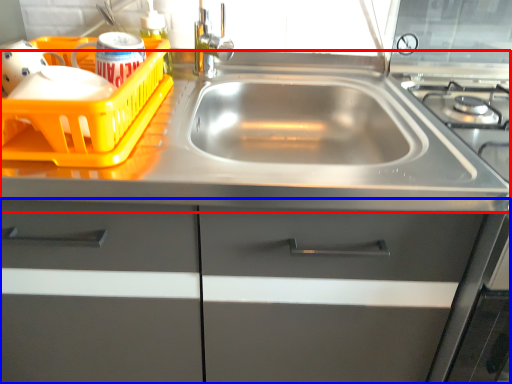
Question: Which point is further to the camera, counter top (highlighted by a red box) or cabinetry (highlighted by a blue box)?

Choices:
 (A) counter top
 (B) cabinetry

Answer: (A)